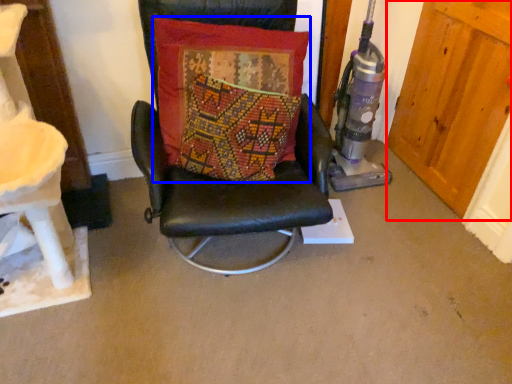
Question: Which object is further to the camera taking this photo, door (highlighted by a red box) or pillow (highlighted by a blue box)?

Choices:
 (A) door
 (B) pillow

Answer: (A)